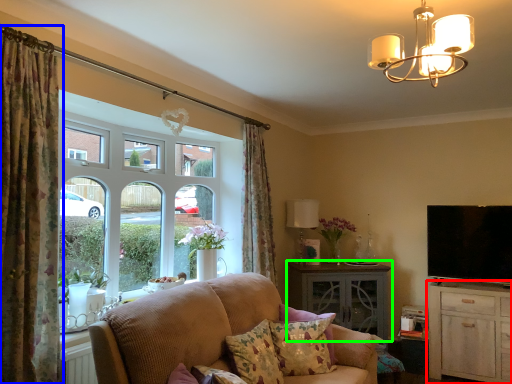
Question: Considering the real-world distances, which object is farthest from cabinetry (highlighted by a red box)? curtain (highlighted by a blue box) or table (highlighted by a green box)?

Choices:
 (A) curtain
 (B) table

Answer: (A)